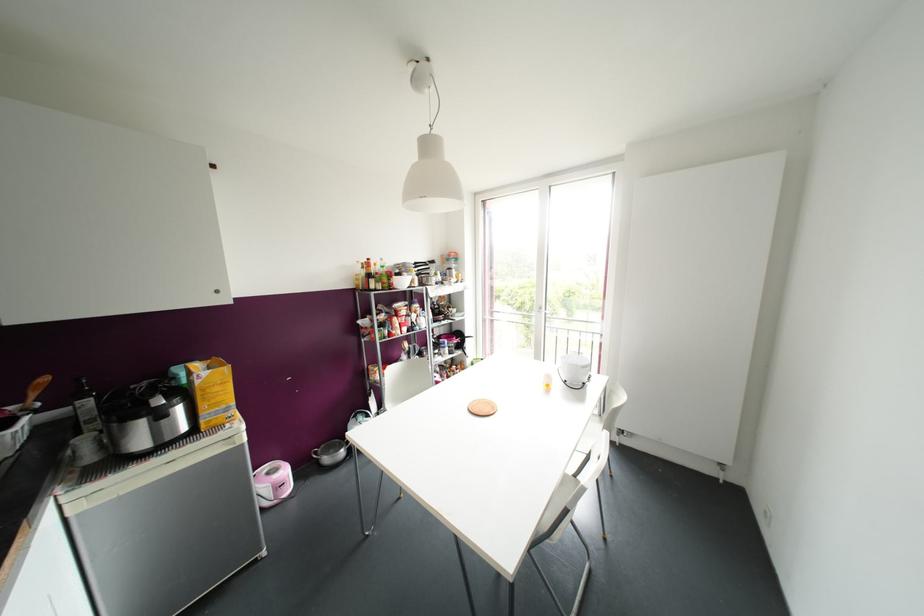
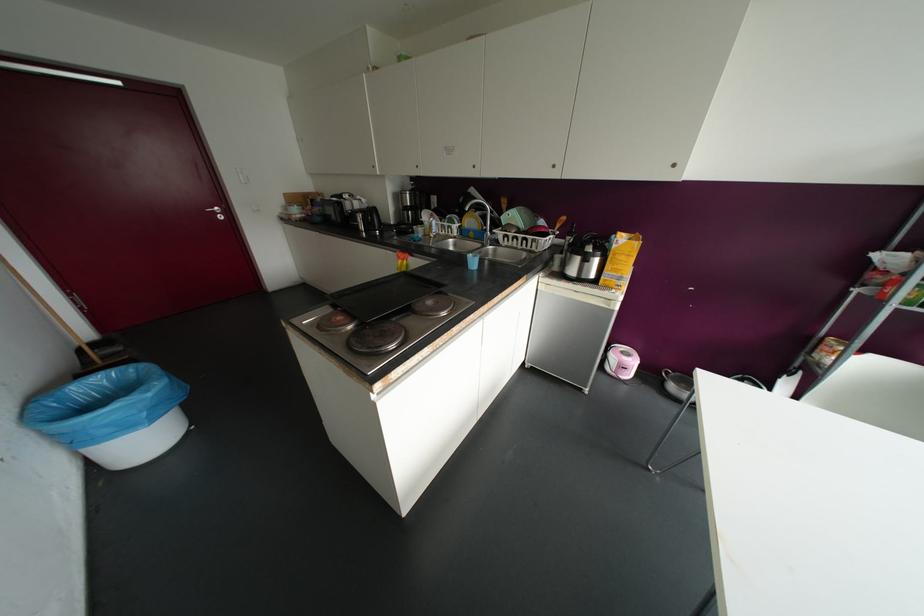
Based on the continuous images, in which direction is the camera rotating?

The camera's rotation is toward left-down.